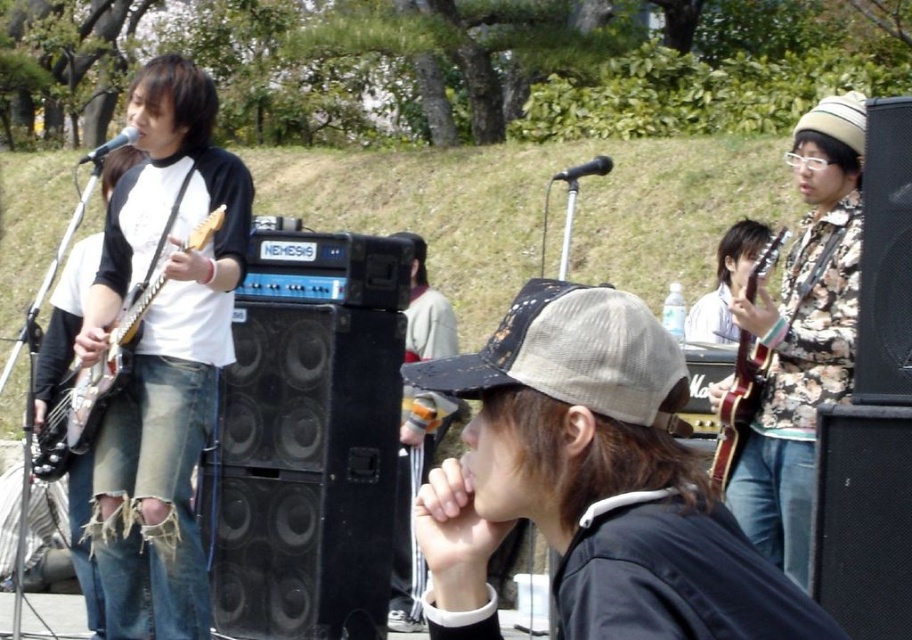
Question: Can you confirm if floral-patterned shirt at right is thinner than matte white electric guitar at left?

Choices:
 (A) no
 (B) yes

Answer: (B)

Question: Which object appears closest to the camera in this image?

Choices:
 (A) wooden acoustic guitar at right
 (B) floral-patterned shirt at right
 (C) ripped denim jeans at left

Answer: (B)

Question: Does wooden acoustic guitar at right have a lesser width compared to matte white electric guitar at left?

Choices:
 (A) yes
 (B) no

Answer: (A)

Question: Which object is closer to the camera taking this photo?

Choices:
 (A) ripped denim jeans at left
 (B) wooden acoustic guitar at right
 (C) floral-patterned shirt at right
 (D) matte white electric guitar at left

Answer: (C)

Question: Is wooden acoustic guitar at right thinner than matte white electric guitar at left?

Choices:
 (A) yes
 (B) no

Answer: (A)

Question: Which point is closer to the camera taking this photo?

Choices:
 (A) (236, 179)
 (B) (133, 305)
 (C) (752, 385)
 (D) (859, 116)

Answer: (D)